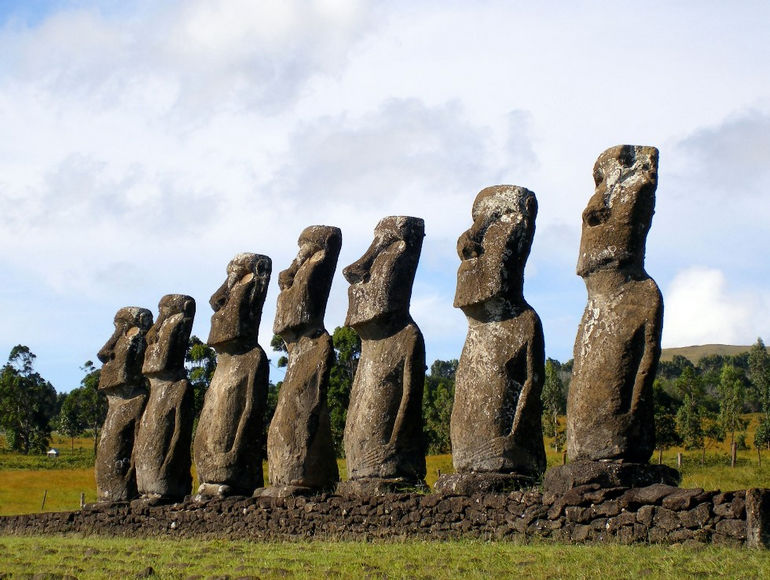
Identify the location of statue arm. This screenshot has height=580, width=770. (654, 351), (533, 380), (407, 398), (319, 397), (249, 409), (182, 432), (129, 469).